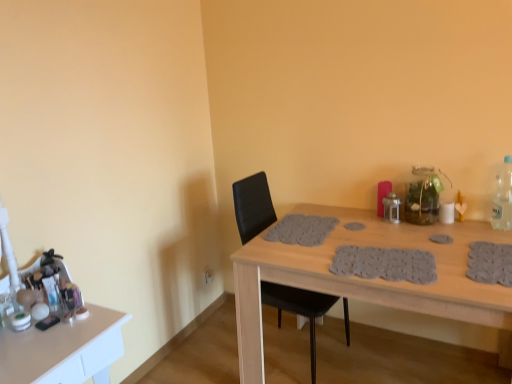
Question: From a real-world perspective, is clear plastic bottle at right over black leather chair at center?

Choices:
 (A) yes
 (B) no

Answer: (A)

Question: Can you confirm if clear plastic bottle at right is smaller than black leather chair at center?

Choices:
 (A) yes
 (B) no

Answer: (A)

Question: Does clear plastic bottle at right lie behind black leather chair at center?

Choices:
 (A) no
 (B) yes

Answer: (B)

Question: Is clear plastic bottle at right not close to black leather chair at center?

Choices:
 (A) no
 (B) yes

Answer: (A)

Question: Is clear plastic bottle at right turned away from black leather chair at center?

Choices:
 (A) yes
 (B) no

Answer: (B)

Question: From the image's perspective, is clear plastic bottle at right under black leather chair at center?

Choices:
 (A) yes
 (B) no

Answer: (B)

Question: From a real-world perspective, is clear plastic bottle at right on wooden table at center, the second table positioned from the left?

Choices:
 (A) no
 (B) yes

Answer: (B)

Question: Is clear plastic bottle at right thinner than wooden table at center, the second table positioned from the left?

Choices:
 (A) no
 (B) yes

Answer: (B)

Question: Does clear plastic bottle at right turn towards wooden table at center, the second table positioned from the left?

Choices:
 (A) yes
 (B) no

Answer: (B)

Question: Considering the relative sizes of clear plastic bottle at right and wooden table at center, the second table positioned from the left, in the image provided, is clear plastic bottle at right smaller than wooden table at center, the second table positioned from the left,?

Choices:
 (A) no
 (B) yes

Answer: (B)

Question: Is clear plastic bottle at right closer to camera compared to wooden table at center, the first table positioned from the right?

Choices:
 (A) no
 (B) yes

Answer: (A)

Question: Would you say clear plastic bottle at right is a long distance from wooden table at center, the first table positioned from the right?

Choices:
 (A) no
 (B) yes

Answer: (A)

Question: Can you confirm if wooden table at center, the first table positioned from the right, is shorter than white glossy makeup at left, arranged as the second table when viewed from the right?

Choices:
 (A) yes
 (B) no

Answer: (B)